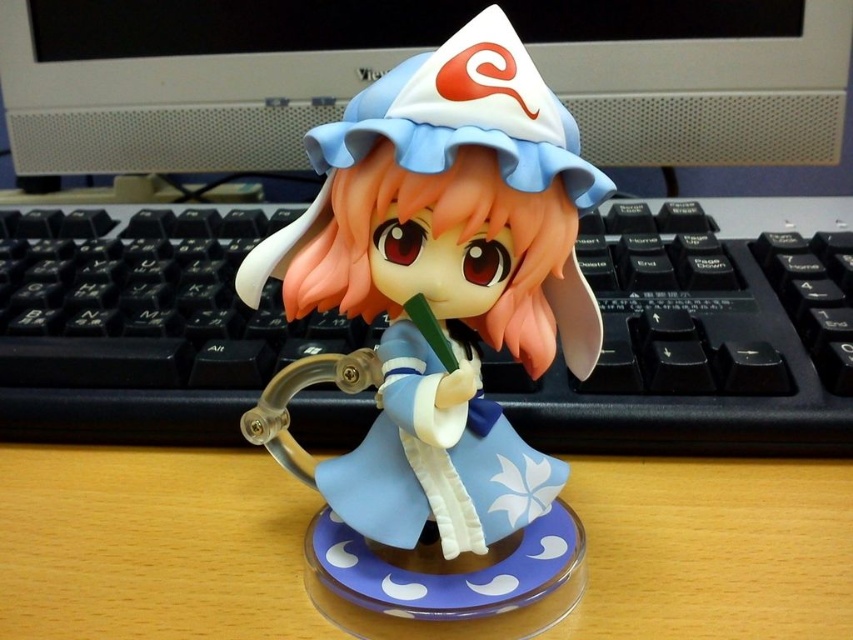
Question: Can you confirm if wooden desk at center is thinner than matte white computer monitor at upper center?

Choices:
 (A) yes
 (B) no

Answer: (B)

Question: Considering the relative positions of matte white computer monitor at upper center and wooden table at center in the image provided, where is matte white computer monitor at upper center located with respect to wooden table at center?

Choices:
 (A) right
 (B) left

Answer: (A)

Question: Which object is farther from the camera taking this photo?

Choices:
 (A) wooden desk at center
 (B) matte white computer monitor at upper center

Answer: (B)

Question: Among these points, which one is nearest to the camera?

Choices:
 (A) (0, 456)
 (B) (79, 604)
 (C) (721, 61)
 (D) (300, 387)

Answer: (B)

Question: Which object is the farthest from the wooden desk at center?

Choices:
 (A) matte plastic figurine at center
 (B) wooden table at center
 (C) matte white computer monitor at upper center

Answer: (C)

Question: Does wooden desk at center have a greater width compared to wooden table at center?

Choices:
 (A) no
 (B) yes

Answer: (B)